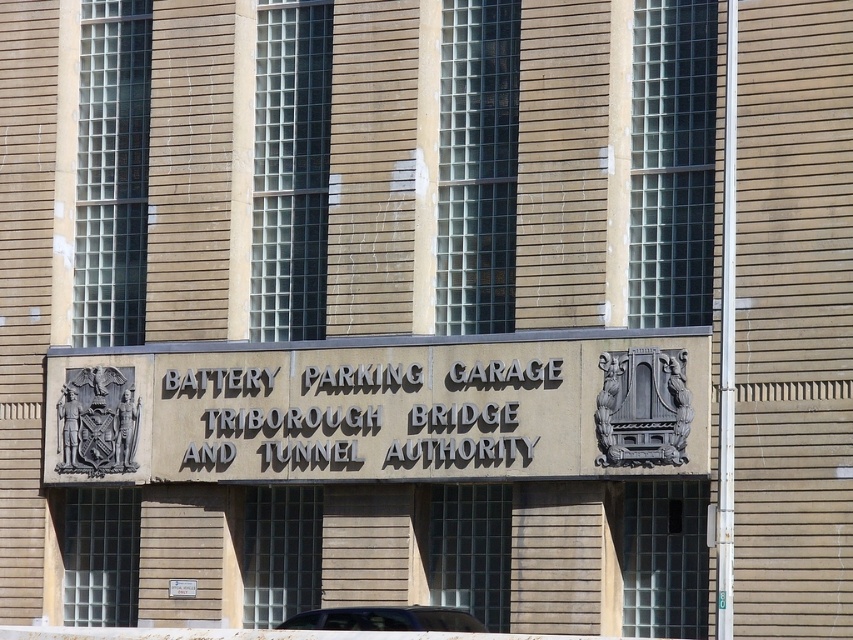
Is the position of gray stone sign at center less distant than that of black stone sign at center?

Yes, gray stone sign at center is in front of black stone sign at center.

The width and height of the screenshot is (853, 640). What do you see at coordinates (381, 412) in the screenshot?
I see `gray stone sign at center` at bounding box center [381, 412].

Find the location of a particular element. gray stone sign at center is located at coordinates (381, 412).

Can you confirm if satin silver car at center is positioned above metallic sign at center?

Correct, satin silver car at center is located above metallic sign at center.

This screenshot has height=640, width=853. What do you see at coordinates (386, 618) in the screenshot?
I see `satin silver car at center` at bounding box center [386, 618].

Identify the location of satin silver car at center. The height and width of the screenshot is (640, 853). (386, 618).

Is point (531, 458) in front of point (457, 620)?

That is False.

Which is behind, point (378, 412) or point (285, 625)?

The point (378, 412) is behind.

You are a GUI agent. You are given a task and a screenshot of the screen. Output one action in this format:
    pyautogui.click(x=<x>, y=<y>)
    Task: Click on the black stone sign at center
    The height and width of the screenshot is (640, 853).
    Given the screenshot: What is the action you would take?
    pyautogui.click(x=357, y=416)